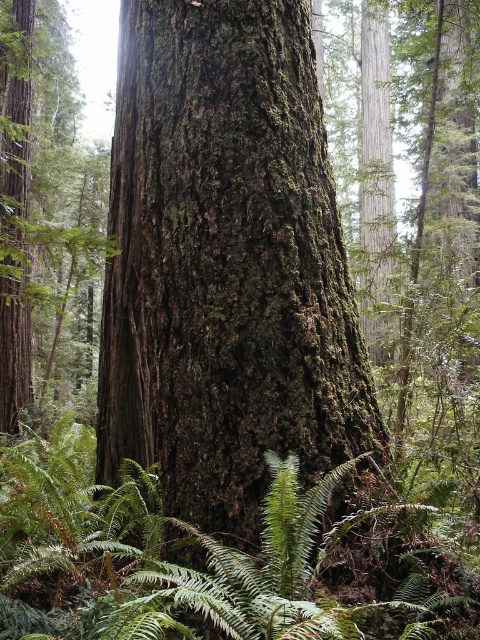
Is green mossy bark at center below green leafy fern at center?

No.

Is point (204, 212) positioned behind point (45, 483)?

No, it is not.

Find the location of `green mossy bark at center`. green mossy bark at center is located at coordinates (226, 264).